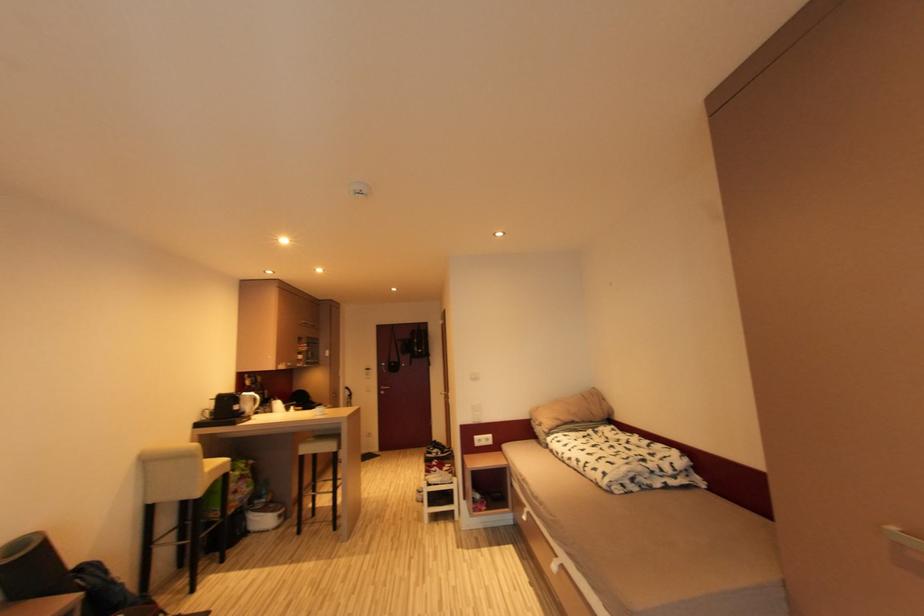
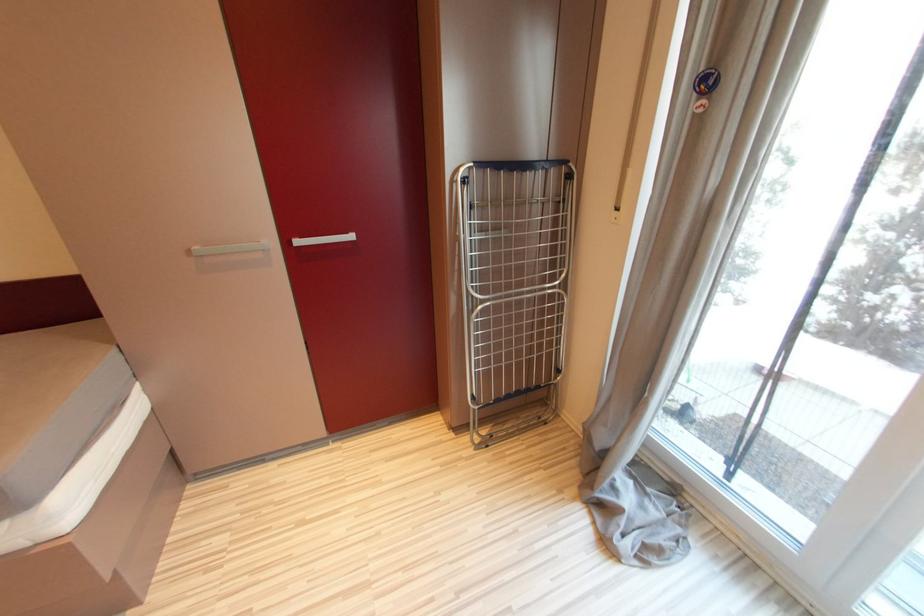
The first image is from the beginning of the video and the second image is from the end. How did the camera likely rotate when shooting the video?

The rotation direction of the camera is right-down.